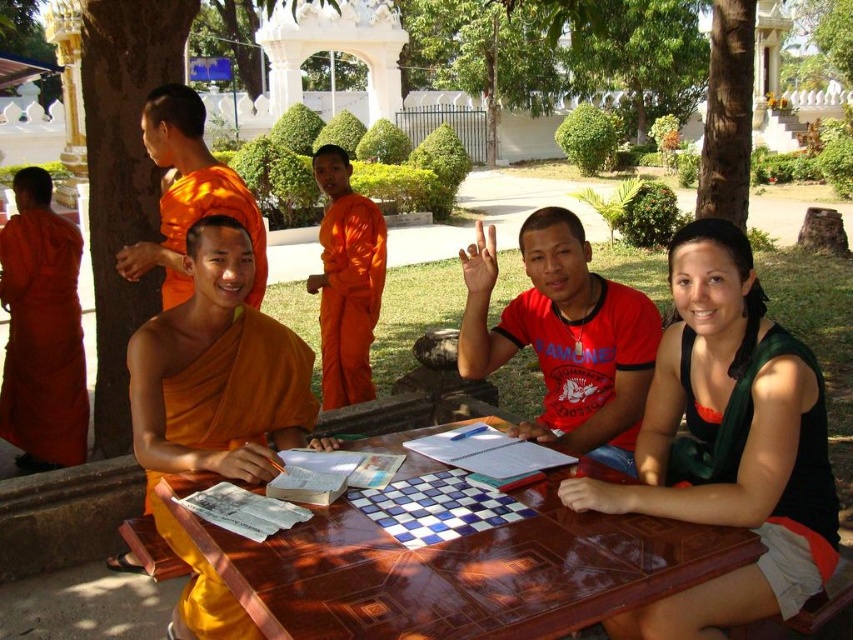
Is point (695, 570) positioned after point (550, 394)?

No.

Does brown wooden table at center have a smaller size compared to red matte shirt at center?

Yes, brown wooden table at center is smaller than red matte shirt at center.

Is point (444, 595) positioned before point (544, 252)?

Yes, point (444, 595) is closer to viewer.

Identify the location of brown wooden table at center. This screenshot has height=640, width=853. (450, 570).

Is orange cloth monk at center positioned at the back of orange cloth robe at left?

No, orange cloth monk at center is in front of orange cloth robe at left.

Which of these two, orange cloth monk at center or orange cloth robe at left, stands shorter?

Standing shorter between the two is orange cloth monk at center.

Between point (647, 616) and point (51, 289), which one is positioned in front?

Point (647, 616) is more forward.

Image resolution: width=853 pixels, height=640 pixels. In order to click on orange cloth monk at center in this screenshot , I will do [x=728, y=444].

Does green fabric skirt at lower right appear under orange cloth at left?

Correct, green fabric skirt at lower right is located below orange cloth at left.

The width and height of the screenshot is (853, 640). Describe the element at coordinates (788, 474) in the screenshot. I see `green fabric skirt at lower right` at that location.

You are a GUI agent. You are given a task and a screenshot of the screen. Output one action in this format:
    pyautogui.click(x=<x>, y=<y>)
    Task: Click on the green fabric skirt at lower right
    The width and height of the screenshot is (853, 640).
    Given the screenshot: What is the action you would take?
    pyautogui.click(x=788, y=474)